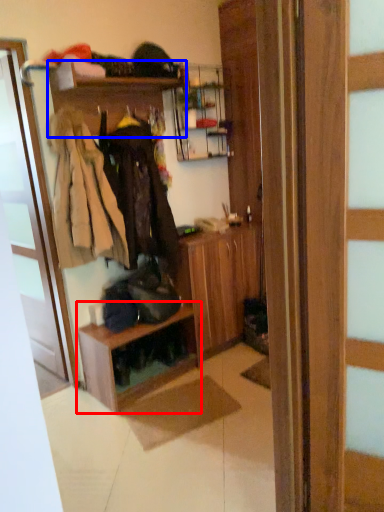
Question: Which point is closer to the camera, shelf (highlighted by a red box) or shelf (highlighted by a blue box)?

Choices:
 (A) shelf
 (B) shelf

Answer: (B)